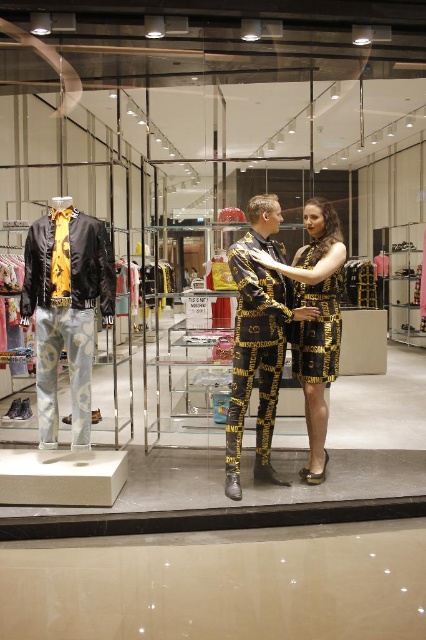
Where is the gold metallic suit at center located in the image?

The gold metallic suit at center is located at point (268, 323).

In the scene shown: You are a customer in the store and want to know if the gold metallic suit at center is part of the same outfit as the gold metallic pants at center. Based on their positions, can you determine if they are worn together?

The gold metallic suit at center is located above the gold metallic pants at center, which suggests they are part of the same outfit worn together.